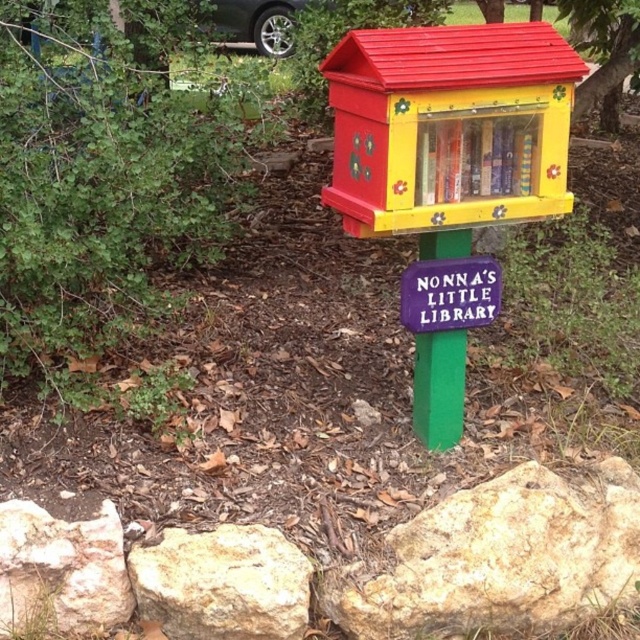
You are a bird flying over the garden and want to land on the closest object between the green textured tree at upper right and the purple matte sign at center. Which object should you choose?

The green textured tree at upper right and the purple matte sign at center are 5.36 feet apart. Since you want to land on the closest object, you need to choose the one that is nearer to your current position. However, without knowing your exact location, it is impossible to determine which object is closer. Please provide more information about your position relative to these objects.

You are a bird looking for a place to land. The wooden painted bird feeder at center and the smooth beige rock at lower left are both options. Which one do you think you can land on comfortably?

The wooden painted bird feeder at center is larger in size than smooth beige rock at lower left, so the bird can land comfortably on the wooden painted bird feeder at center.

You are a delivery person who needs to place a small package next to the purple matte sign at center. However, there is a smooth beige rock at lower right nearby. Can you place the package between them without moving the rock?

The smooth beige rock at lower right is larger than the purple matte sign at center, so there might not be enough space between them to place the package. You may need to choose another location.